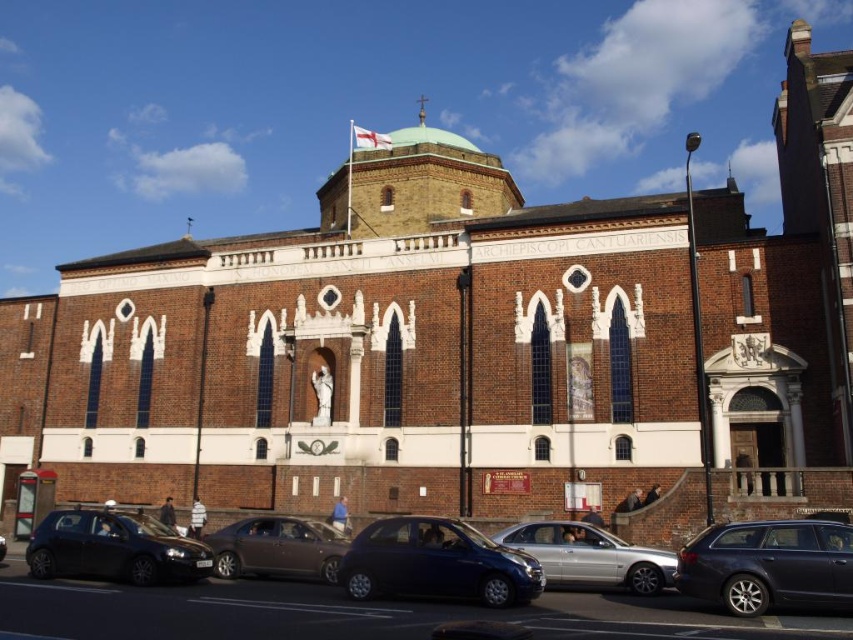
Question: Is dark gray metallic station wagon at lower right to the right of metallic blue car at center from the viewer's perspective?

Choices:
 (A) yes
 (B) no

Answer: (A)

Question: Among these points, which one is farthest from the camera?

Choices:
 (A) (393, 577)
 (B) (773, 577)
 (C) (140, 534)

Answer: (C)

Question: Is shiny black car at lower left to the right of silver metallic sedan at center from the viewer's perspective?

Choices:
 (A) no
 (B) yes

Answer: (A)

Question: Which object appears closest to the camera in this image?

Choices:
 (A) dark gray metallic station wagon at lower right
 (B) matte brown sedan at center

Answer: (A)

Question: Is dark gray metallic station wagon at lower right to the right of matte brown sedan at center from the viewer's perspective?

Choices:
 (A) no
 (B) yes

Answer: (B)

Question: Among these objects, which one is farthest from the camera?

Choices:
 (A) dark gray metallic station wagon at lower right
 (B) shiny black car at lower left

Answer: (B)